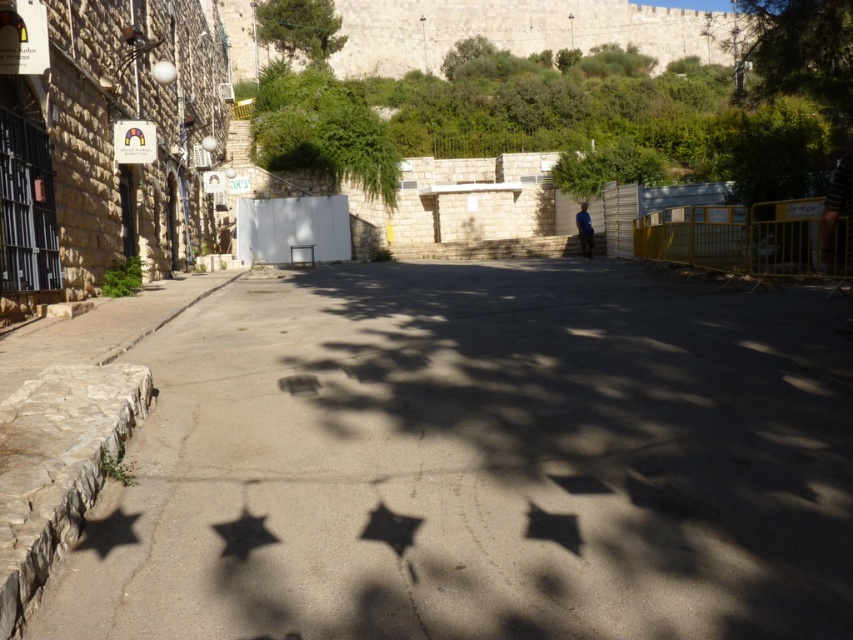
You are standing at point (390, 528) in the image. What object is directly beneath your feet?

The metallic star at center is located at point (390, 528), so the object directly beneath your feet is the metallic star at center.

You are a street artist planning to paint over the stars on the ground. You need to know which metallic star at lower left and metallic silver star at center is wider to decide which requires more paint. According to the scene, which one is wider?

The metallic star at lower left is wider than the metallic silver star at center, so it requires more paint.

You are a tourist standing on the street and see two metallic stars on the ground. The first one is labeled as metallic star at center and the second is metallic silver star at center. Which one is larger in size?

The metallic star at center is bigger than the metallic silver star at center according to the description.